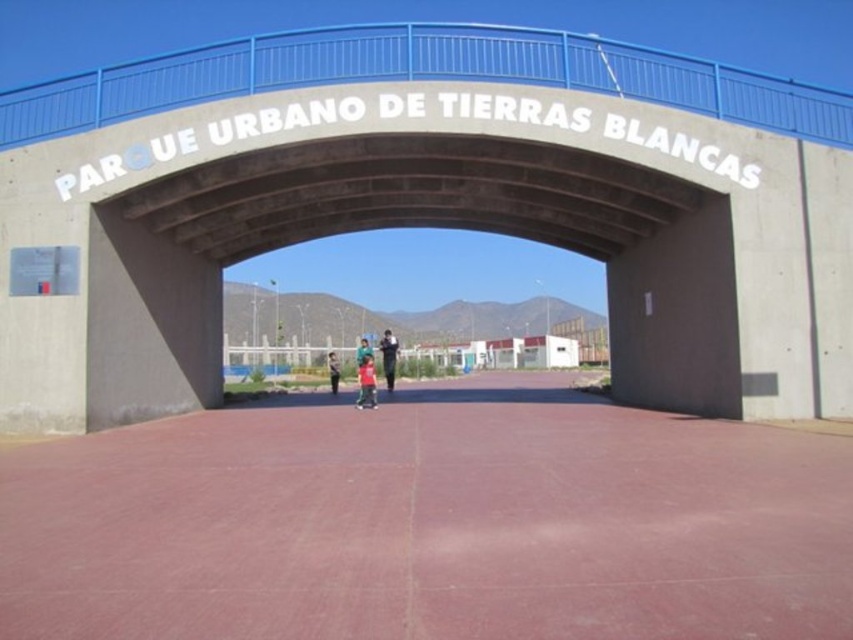
Question: Which object is positioned closest to the light brown leather jacket at center?

Choices:
 (A) blue denim shirt at center
 (B) dark blue jeans at center
 (C) concrete bridge at center

Answer: (A)

Question: Does concrete bridge at center have a lesser width compared to dark blue jeans at center?

Choices:
 (A) yes
 (B) no

Answer: (B)

Question: Which object is the farthest from the blue denim shirt at center?

Choices:
 (A) concrete bridge at center
 (B) light brown leather jacket at center
 (C) dark blue jeans at center

Answer: (C)

Question: Does light brown leather jacket at center appear on the right side of blue denim shirt at center?

Choices:
 (A) yes
 (B) no

Answer: (B)

Question: Based on their relative distances, which object is farther from the blue denim shirt at center?

Choices:
 (A) dark blue jeans at center
 (B) light brown leather jacket at center
 (C) concrete bridge at center

Answer: (A)

Question: In this image, where is concrete bridge at center located relative to light brown leather jacket at center?

Choices:
 (A) right
 (B) left

Answer: (A)